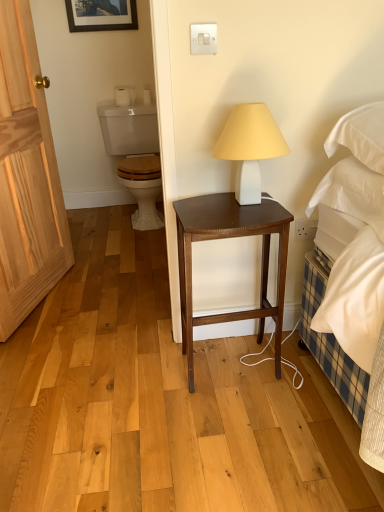
Where is `vacant space to the left of dark wood stool at center`? The image size is (384, 512). vacant space to the left of dark wood stool at center is located at coordinates (144, 388).